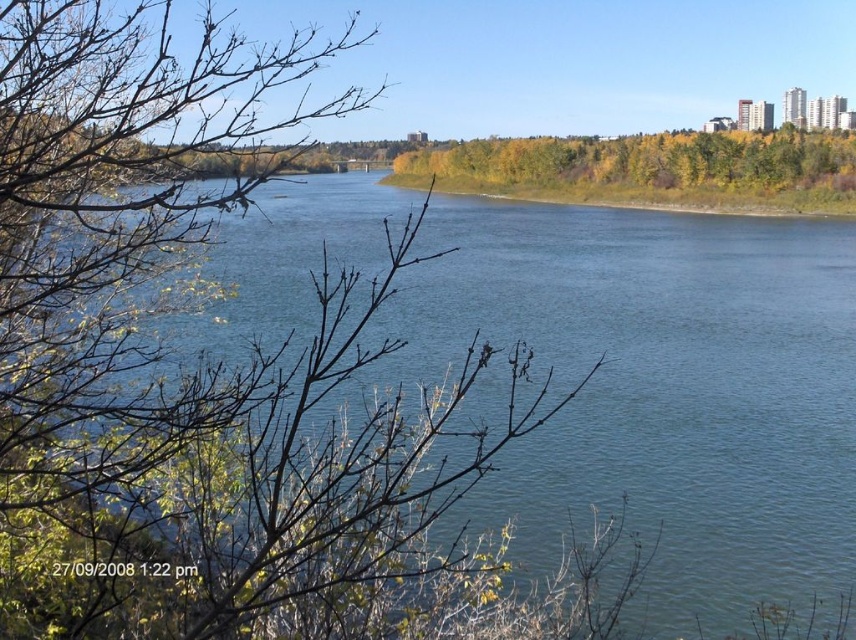
You are standing at the riverside and notice two elements in the center of the image. One is labeled as green leafy trees at center and the other as green leafy vegetation at center. Which of these two elements is larger in size?

The green leafy trees at center is bigger than the green leafy vegetation at center.